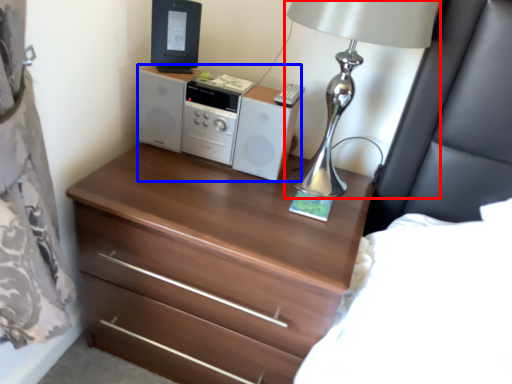
Question: Which of the following is the closest to the observer, table lamp (highlighted by a red box) or stereo (highlighted by a blue box)?

Choices:
 (A) table lamp
 (B) stereo

Answer: (A)